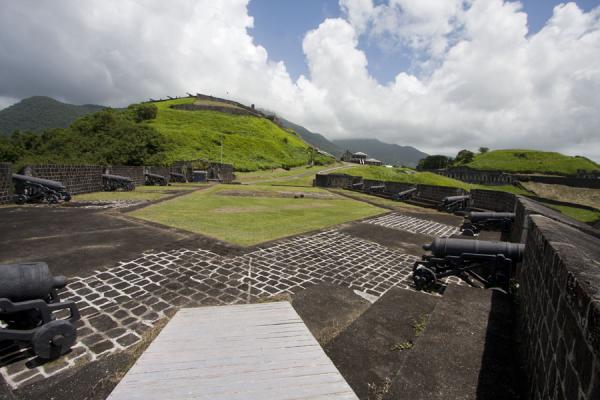
Locate an element on the screen. This screenshot has height=400, width=600. brick wall is located at coordinates (84, 180), (574, 303).